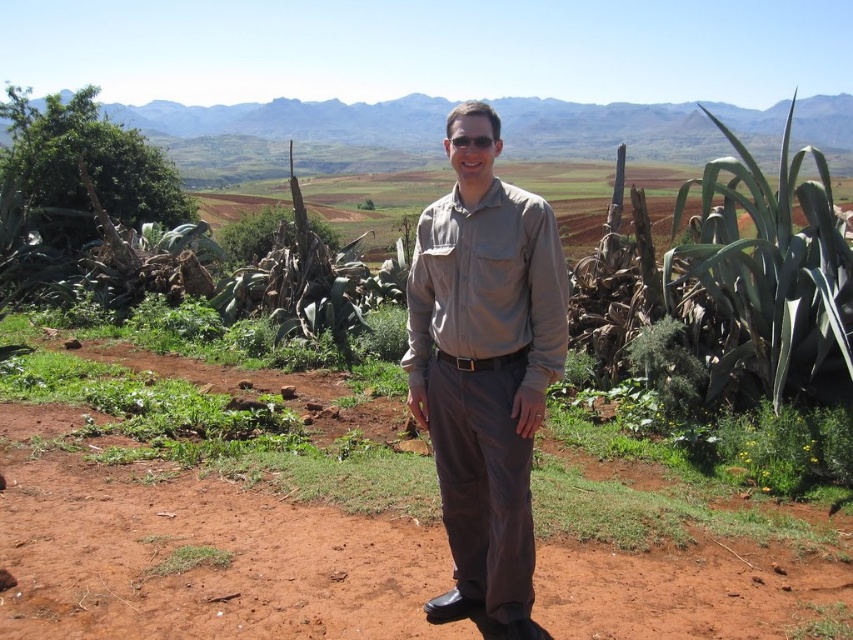
Is point (527, 566) positioned behind point (207, 561)?

No, (527, 566) is closer to viewer.

Consider the image. Is matte khaki shirt at center closer to the viewer compared to green grass at lower left?

Yes, it is in front of green grass at lower left.

Does point (480, 419) come behind point (173, 563)?

That is False.

Locate an element on the screen. The height and width of the screenshot is (640, 853). matte khaki shirt at center is located at coordinates (485, 368).